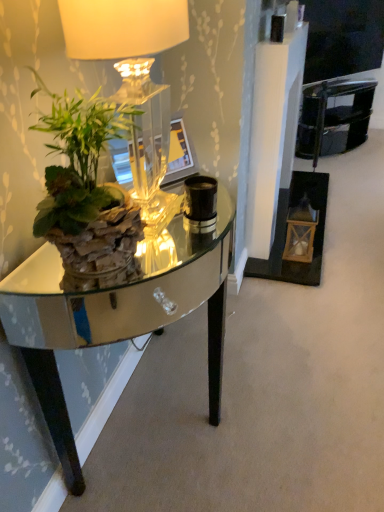
Question: Is clear glass table at left bigger or smaller than green leafy plant at left?

Choices:
 (A) big
 (B) small

Answer: (A)

Question: In the image, is clear glass table at left on the left side or the right side of green leafy plant at left?

Choices:
 (A) left
 (B) right

Answer: (B)

Question: Based on their relative distances, which object is farther from the green leafy plant at left?

Choices:
 (A) clear glass table at left
 (B) black glossy armchair at upper right
 (C) matte glass lamp at upper left

Answer: (B)

Question: Considering the real-world distances, which object is closest to the matte glass lamp at upper left?

Choices:
 (A) black glossy armchair at upper right
 (B) green leafy plant at left
 (C) clear glass table at left

Answer: (B)